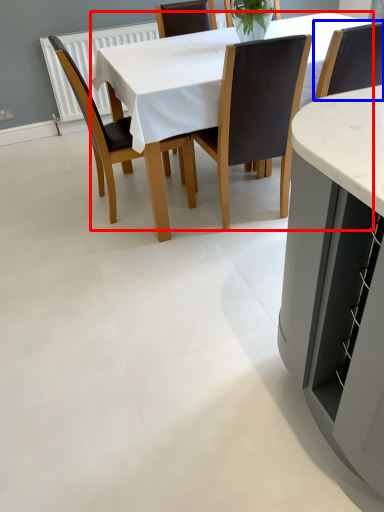
Question: Among these objects, which one is nearest to the camera, kitchen & dining room table (highlighted by a red box) or chair (highlighted by a blue box)?

Choices:
 (A) kitchen & dining room table
 (B) chair

Answer: (A)